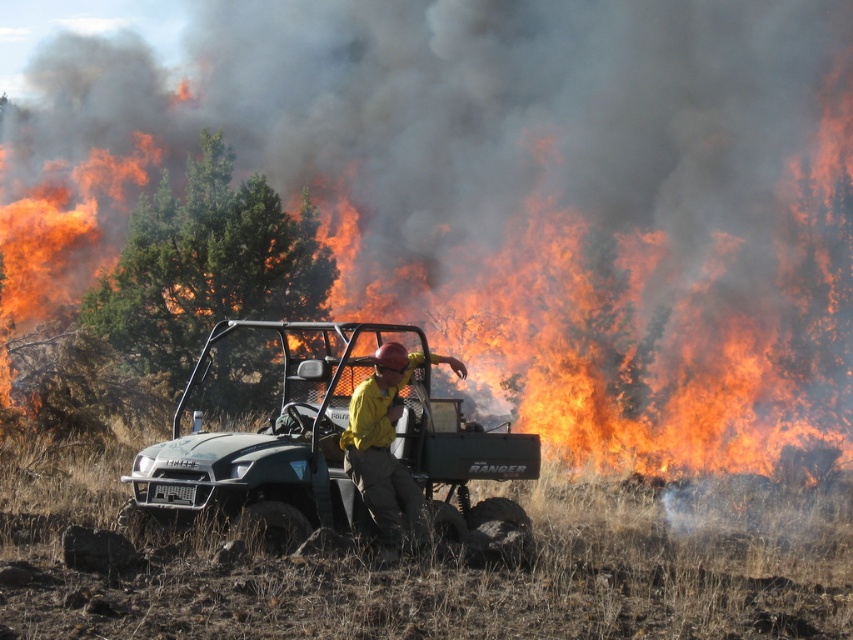
Based on the scene description, where is the green matte utility vehicle at center located in terms of its 2D coordinates?

The green matte utility vehicle at center is located at the 2D coordinates point (339,449).